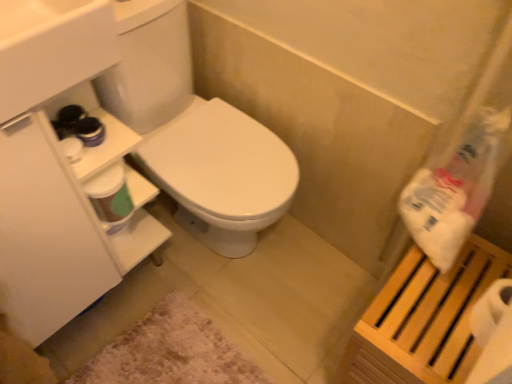
Identify the location of free spot to the left of white matte toilet paper at right. The height and width of the screenshot is (384, 512). (428, 322).